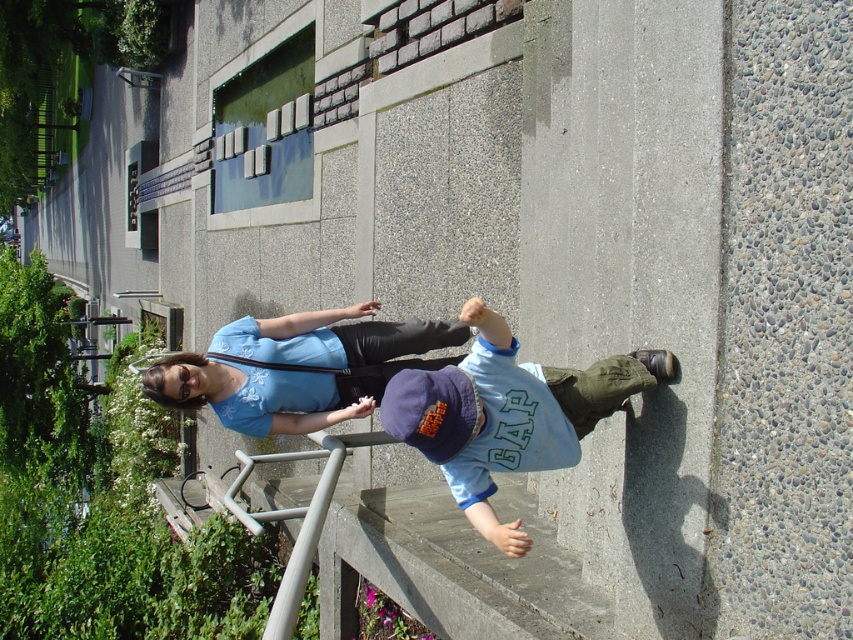
Which of these two, blue cotton shirt at center or matte blue shirt at center, stands taller?

Standing taller between the two is blue cotton shirt at center.

Does point (508, 397) come farther from viewer compared to point (447, 342)?

No, it is not.

Identify the location of blue cotton shirt at center. (506, 413).